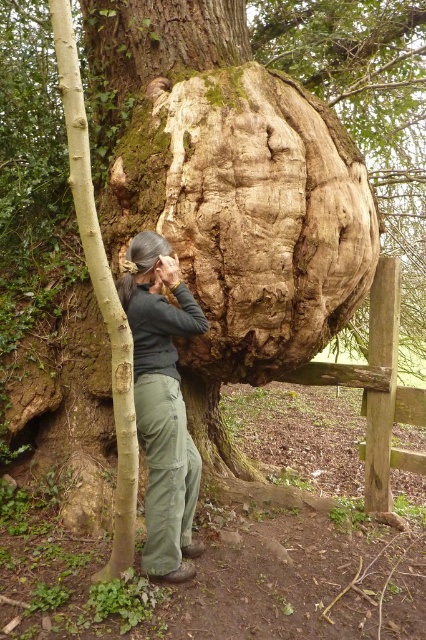
You are standing at the point marked by the coordinates point [161,403]. Looking around, you see the dark green pants at center. Which direction should you walk to reach the large tree trunk with the human figure growth?

Since the dark green pants at center is located at point [161,403], you should walk towards the tree trunk which is positioned to the left of the dark green pants at center. However, based on the provided information, there is no specific direction indicated between the pants and the tree trunk in the Objects Description. Therefore, I cannot determine the exact direction to walk.

You are a fashion designer observing the scene. You need to create a pair of pants that can comfortably fit over the unusual growth on the tree. Given the dark green pants at center and the smooth light brown bark at left, which object has a greater width that you should consider for the pants design?

The dark green pants at center has a greater width than the smooth light brown bark at left, so the design should account for the wider measurement of the dark green pants at center to ensure comfort over the unusual growth.

You are standing in a forest and see the dark green pants at center and the smooth light brown bark at left. Which object is positioned more to the left?

The smooth light brown bark at left is positioned more to the left than the dark green pants at center.